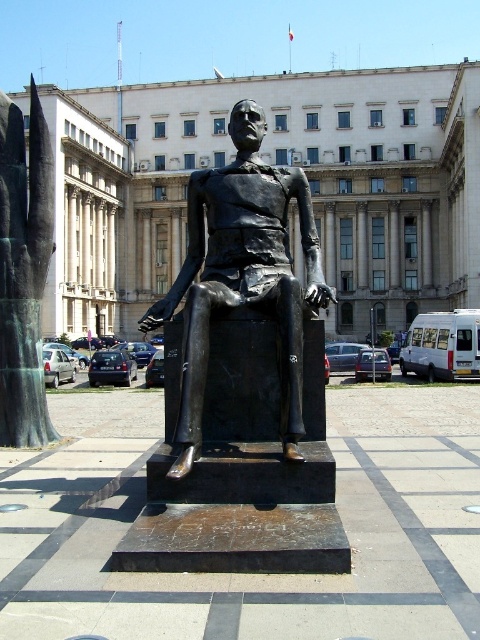
You are standing in front of the statue in the public square. You want to take a photo of the white marble building at center. Is it possible to capture the entire building in one shot without moving your camera?

The white marble building at center is 58.44 meters away from the camera. Depending on the camera lens used, it may be possible to capture the entire building in one shot without moving the camera. A wide angle lens would be recommended to ensure the entire structure is in frame.

You are standing in the public square and want to take a photo of the statue. The statue is at point (276, 164). Is the white marble building at center in your photo frame?

The white marble building at center is located at point (276, 164), so it will be in the photo frame.

You are a tourist standing in the public square and want to take a photo of both the white marble building at center and the bronze statue at left. Which object should you focus on first to ensure both are in the frame?

You should focus on the bronze statue at left first because the white marble building at center is much taller, so adjusting the camera angle to include its height while capturing the bronze statue at left will require framing from the base upwards.